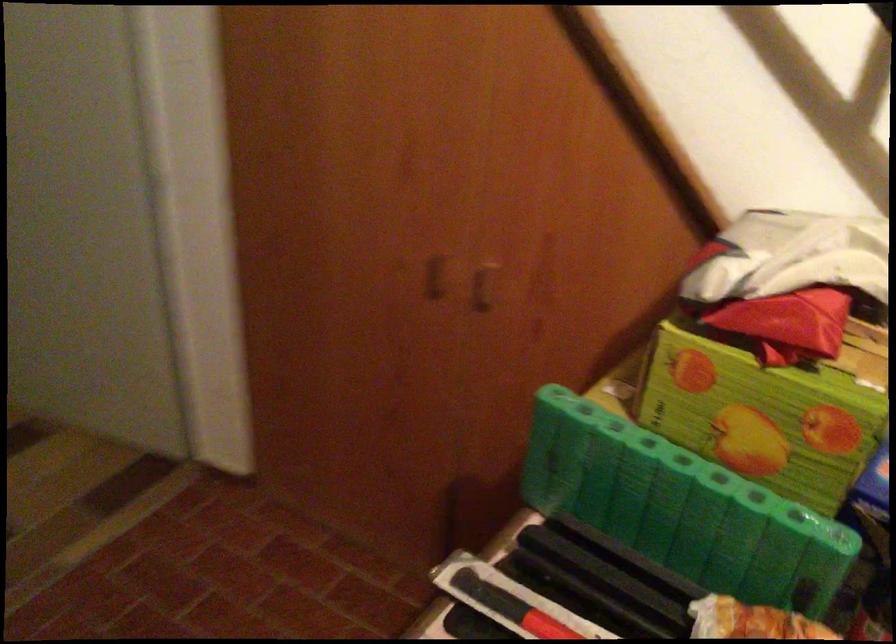
The height and width of the screenshot is (644, 896). Find the location of `brown cabinet handle`. brown cabinet handle is located at coordinates (460, 281).